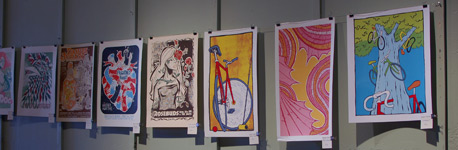
Where is `gray back wall`? gray back wall is located at coordinates (35, 15), (81, 16), (171, 18), (282, 6), (355, 6), (382, 133), (175, 145), (117, 141), (42, 137).